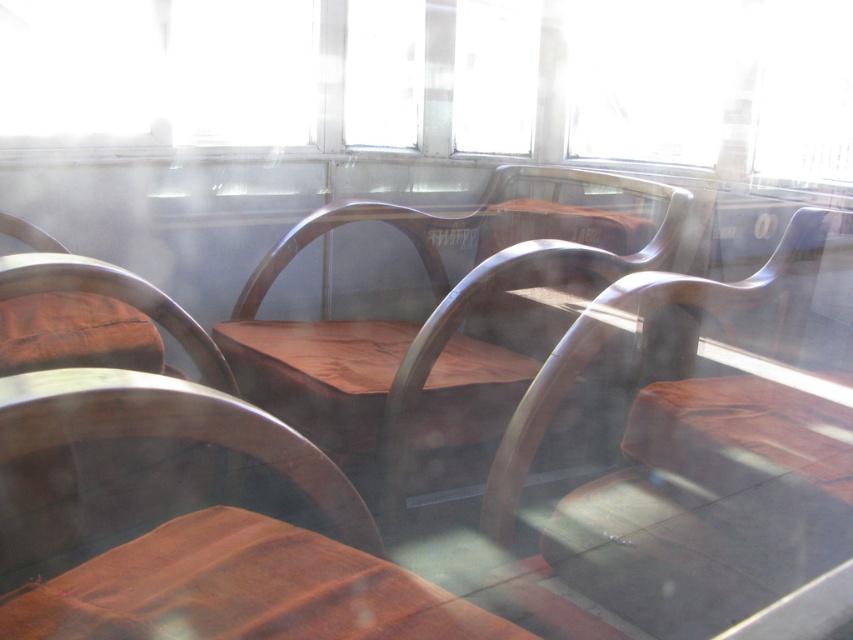
You are a student who needs to choose a chair to sit on. You have to decide between the wooden seat at center and the shiny brown wood chair at center. Which one is bigger?

The wooden seat at center is larger in size compared to the shiny brown wood chair at center.

You are organizing a small event in the classroom and need to place a 1.2 meter wide banner between the shiny brown wood chair at center and the brown leather table at lower left. Can the space between them accommodate the banner?

The shiny brown wood chair at center is bigger than the brown leather table at lower left. However, the exact distance between them isn not specified. Without knowing the distance between the two objects, it is impossible to determine if the banner will fit. Please measure the space first.